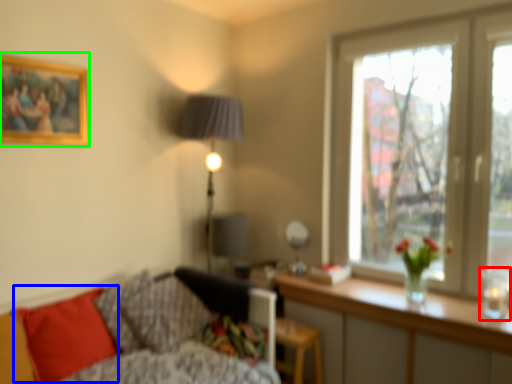
Question: Considering the real-world distances, which object is closest to candle holder (highlighted by a red box)? pillow (highlighted by a blue box) or picture frame (highlighted by a green box).

Choices:
 (A) pillow
 (B) picture frame

Answer: (A)